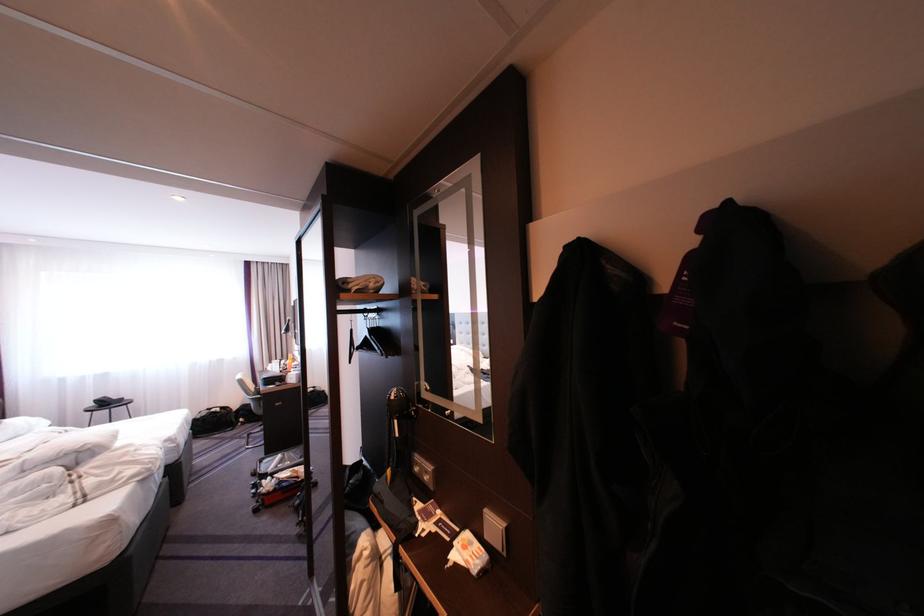
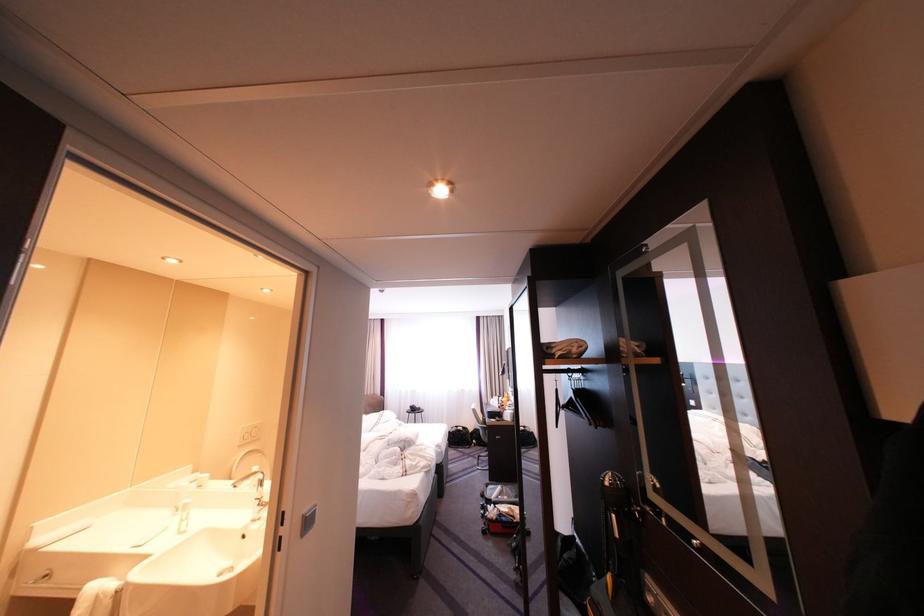
The point at (x=261, y=395) is marked in the first image. Where is the corresponding point in the second image?

(491, 424)